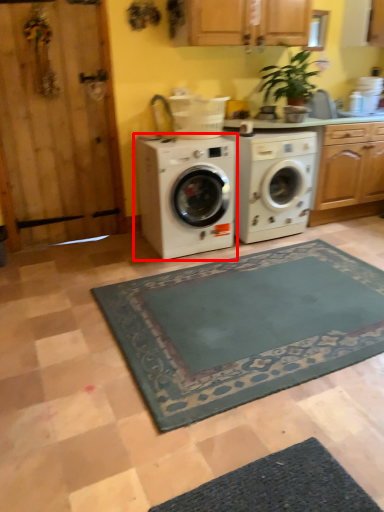
Question: From the image's perspective, where is washing machine (annotated by the red box) located in relation to washing machine in the image?

Choices:
 (A) below
 (B) above

Answer: (A)